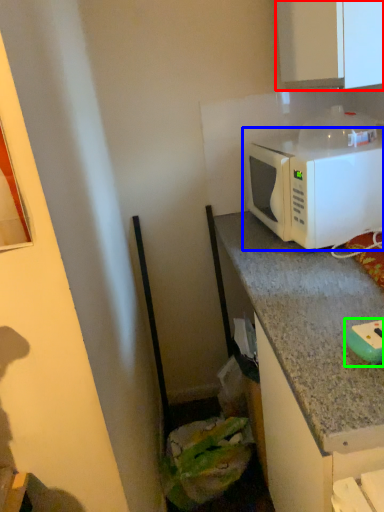
Question: Estimate the real-world distances between objects in this image. Which object is closer to cabinetry (highlighted by a red box), microwave oven (highlighted by a blue box) or appliance (highlighted by a green box)?

Choices:
 (A) microwave oven
 (B) appliance

Answer: (A)